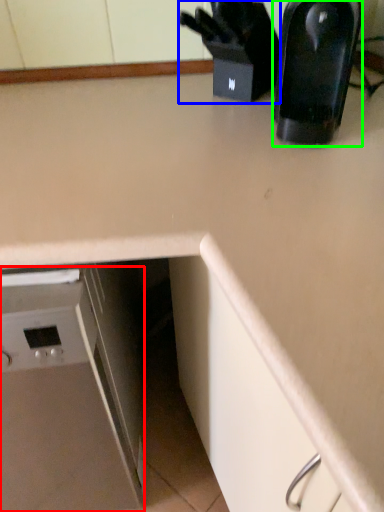
Question: Based on their relative distances, which object is nearer to home appliance (highlighted by a red box)? Choose from appliance (highlighted by a blue box) and kitchen appliance (highlighted by a green box).

Choices:
 (A) appliance
 (B) kitchen appliance

Answer: (B)